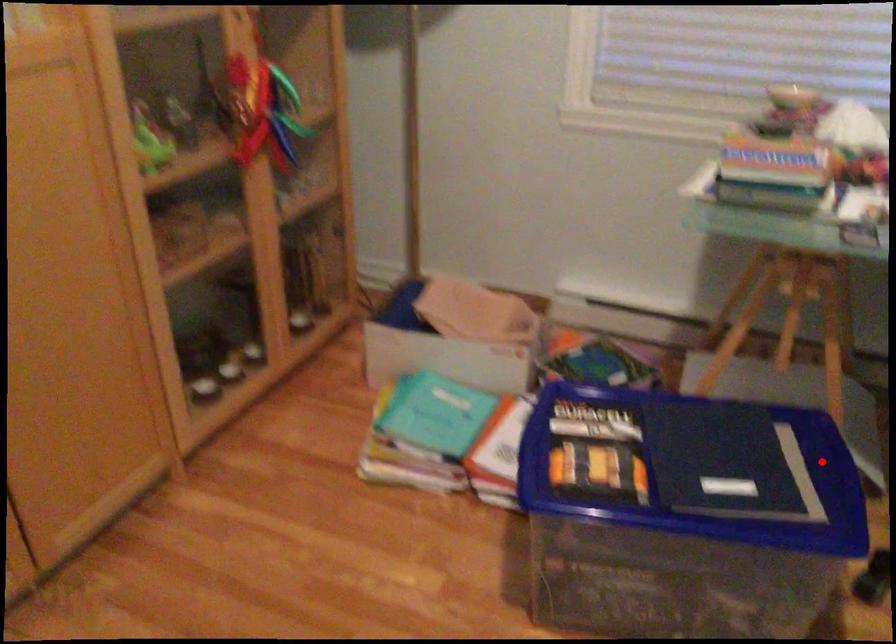
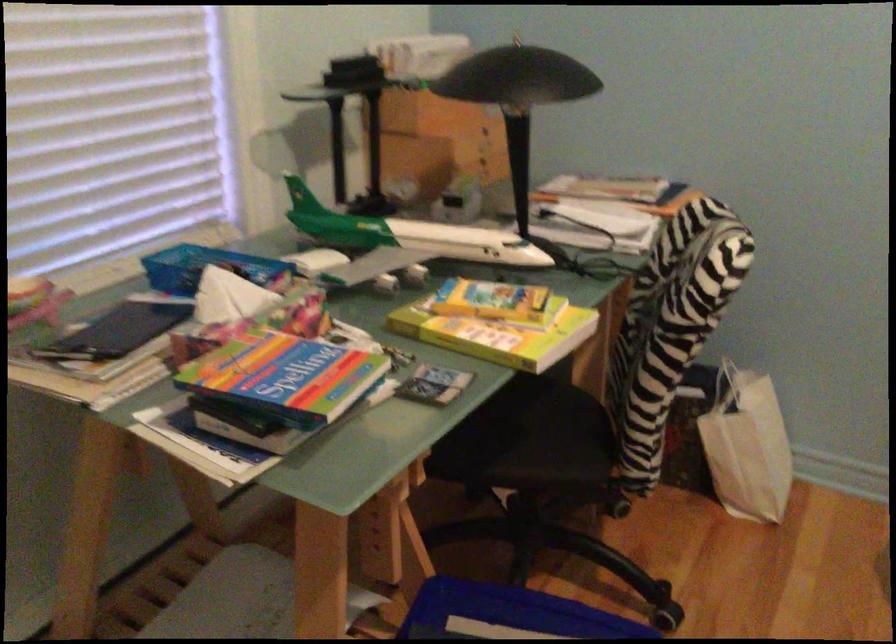
Locate, in the second image, the point that corresponds to the highlighted location in the first image.

(507, 614)